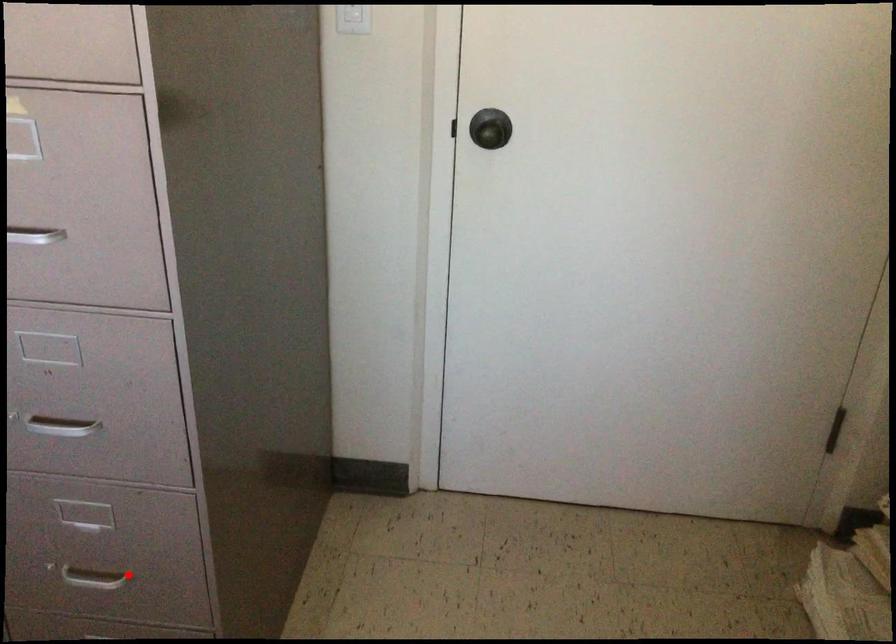
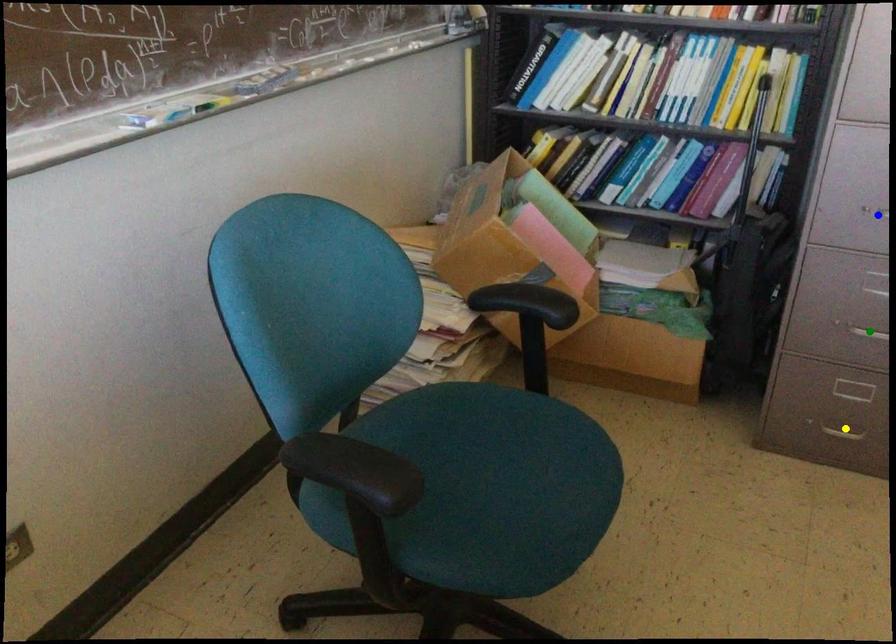
Question: I am providing you with two images of the same scene from different viewpoints. A red point is marked on the first image. You are given multiple points on the second image. Can you choose the point in image 2 that corresponds to the point in image 1?

Choices:
 (A) yellow point
 (B) blue point
 (C) green point

Answer: (C)